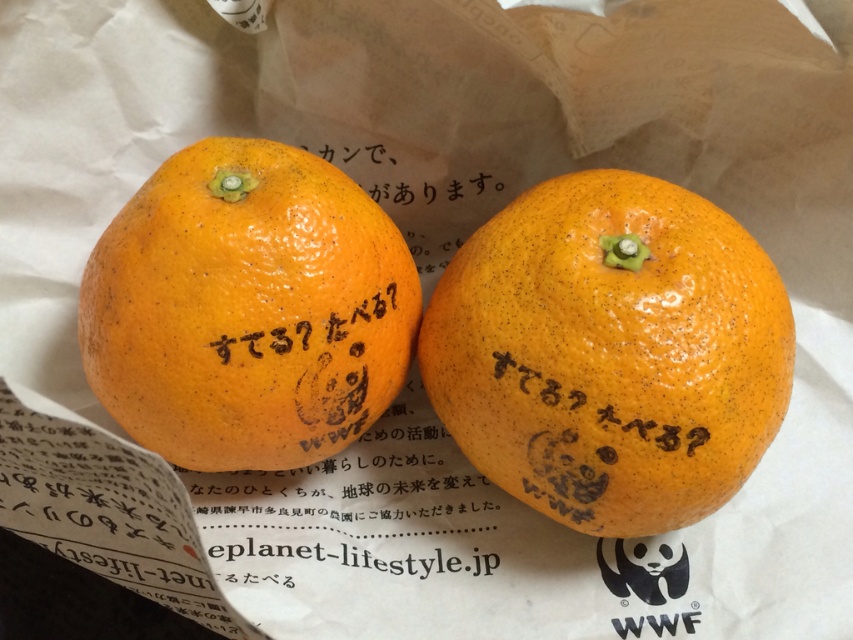
You are organizing a fruit basket and have two oranges in front of you. The orangesmoothorange at center and the orangesmoothorange at left. Which one is larger?

The orangesmoothorange at center is bigger than the orangesmoothorange at left.

You are organizing a fruit display and need to place the orangesmoothorange at center and orangesmoothorange at left in a specific order. According to the image, which orange should be placed to the right of the other?

The orangesmoothorange at center should be placed to the right of the orangesmoothorange at left because the orangesmoothorange at center is positioned on the right side of orangesmoothorange at left.